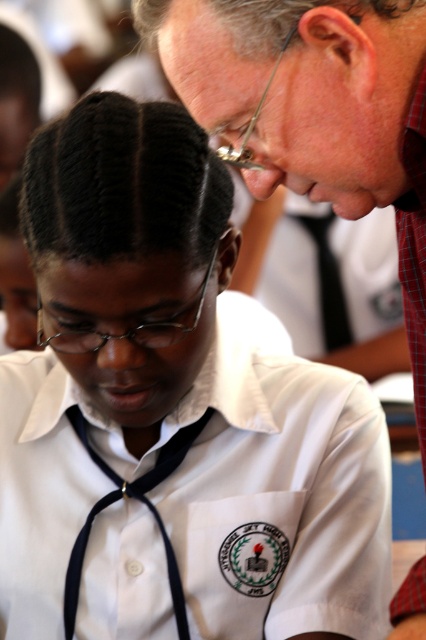
Question: Is matte red shirt at upper right closer to the viewer compared to matte black forehead at center?

Choices:
 (A) no
 (B) yes

Answer: (B)

Question: Can you confirm if white fabric shirt at center is wider than matte red shirt at upper right?

Choices:
 (A) yes
 (B) no

Answer: (A)

Question: Which object is positioned closest to the white fabric shirt at center?

Choices:
 (A) matte red shirt at upper right
 (B) matte black forehead at center

Answer: (B)

Question: Which point appears closest to the camera in this image?

Choices:
 (A) (111, 310)
 (B) (115, 442)

Answer: (A)

Question: Is white fabric shirt at center positioned in front of matte black forehead at center?

Choices:
 (A) yes
 (B) no

Answer: (B)

Question: Based on their relative distances, which object is nearer to the matte black forehead at center?

Choices:
 (A) matte red shirt at upper right
 (B) white fabric shirt at center

Answer: (A)